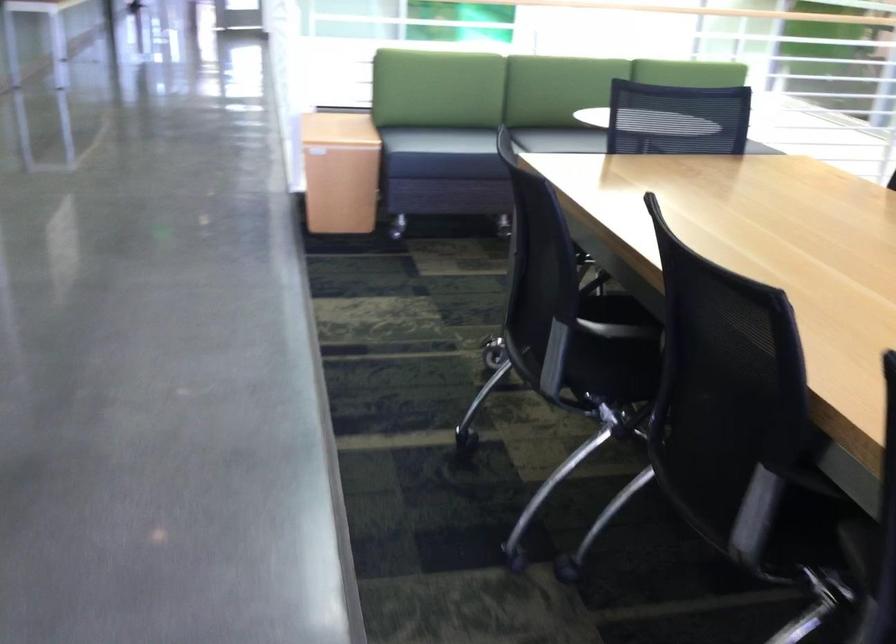
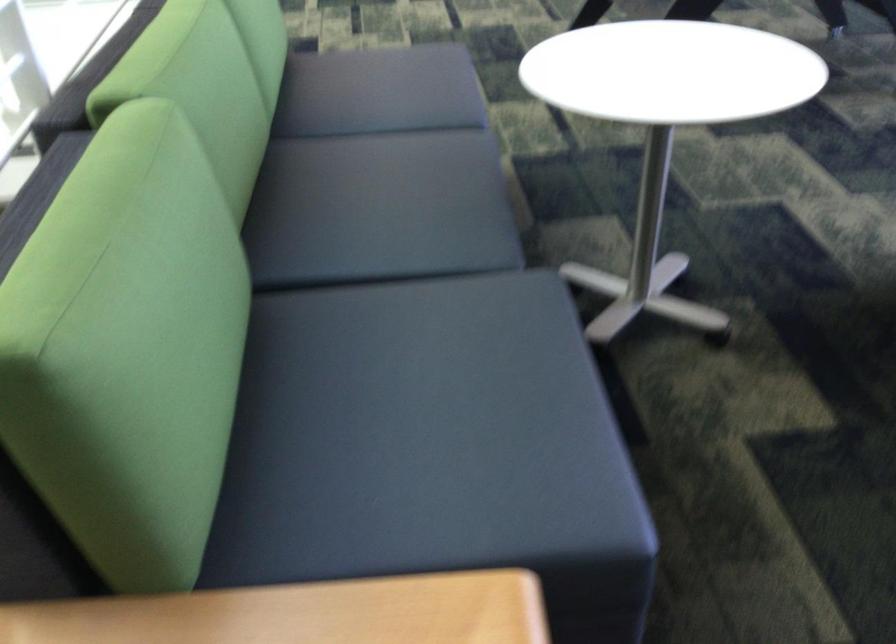
The point at (504, 124) is marked in the first image. Where is the corresponding point in the second image?

(380, 210)